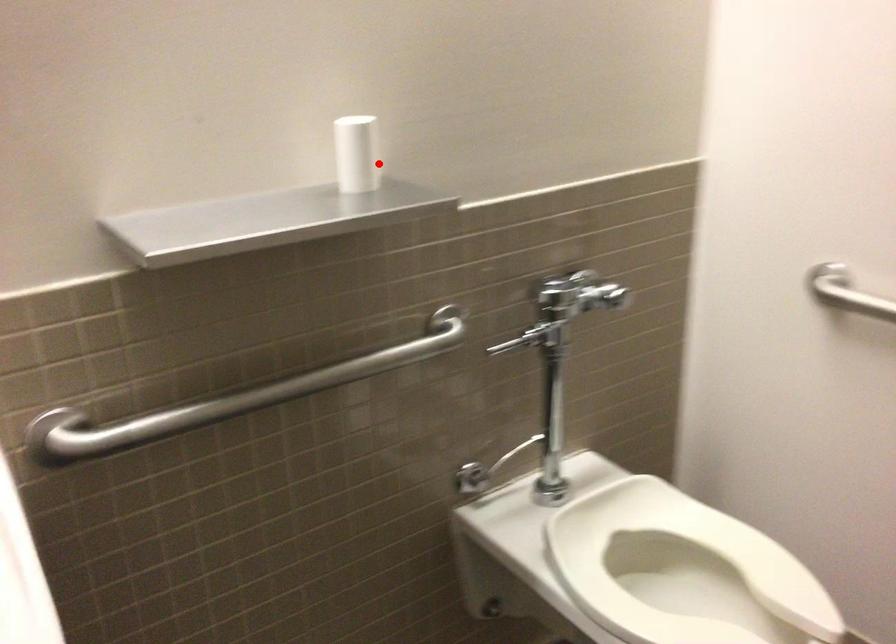
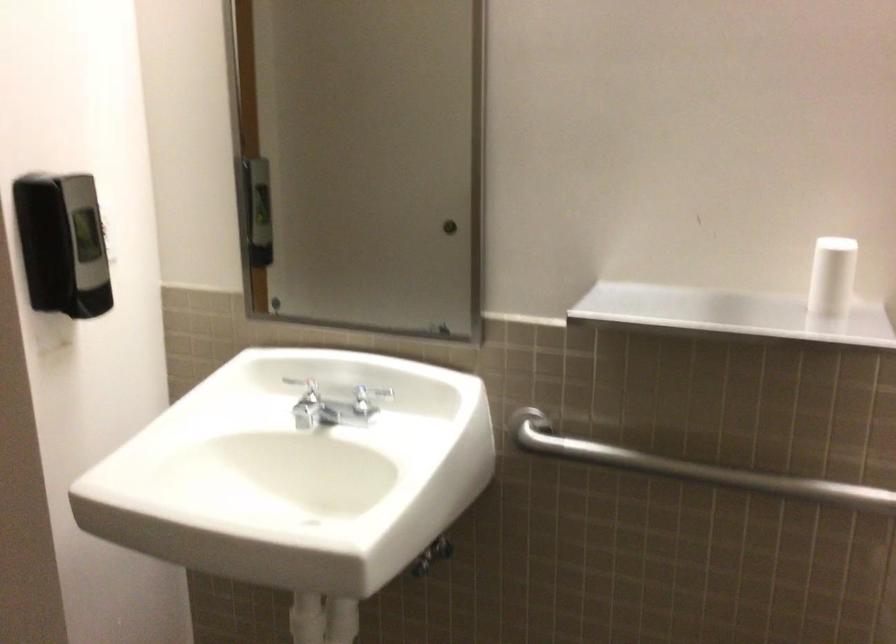
In the second image, find the point that corresponds to the highlighted location in the first image.

(831, 277)